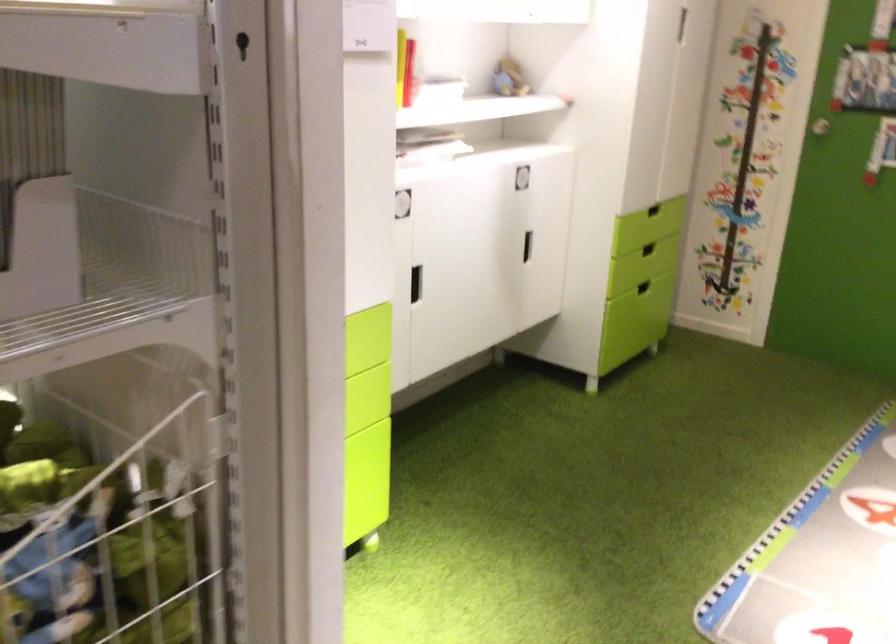
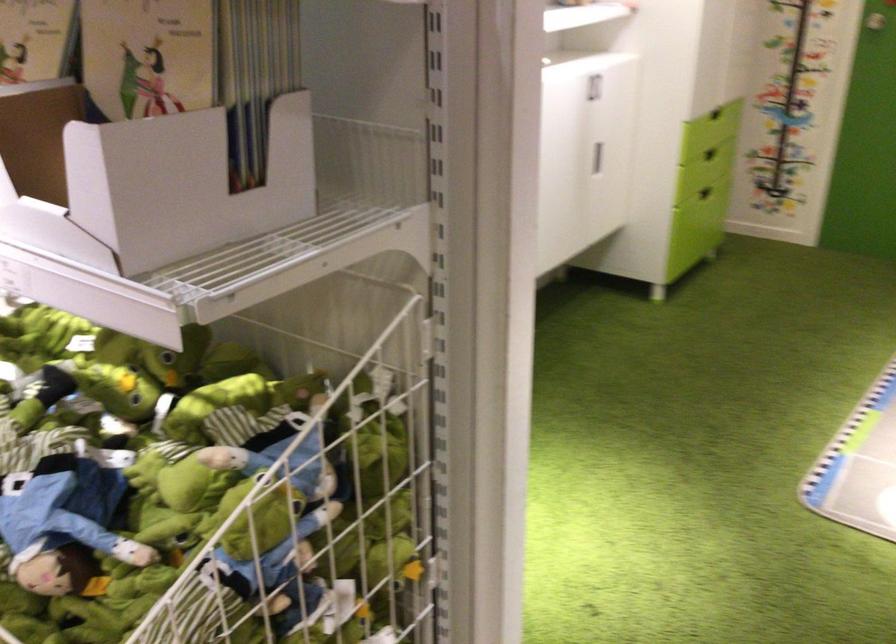
In the second image, find the point that corresponds to [647,249] in the first image.

(710, 154)